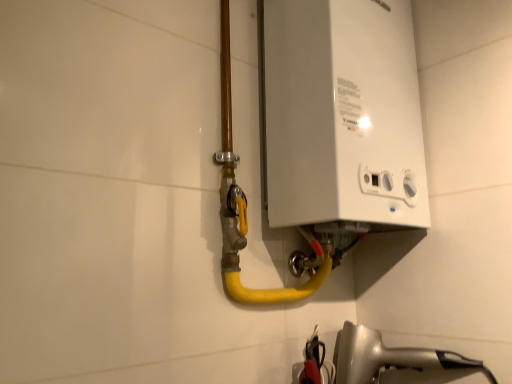
Question: Considering the positions of white plastic boiler at upper right and white glossy hairdryer at lower right in the image, is white plastic boiler at upper right taller or shorter than white glossy hairdryer at lower right?

Choices:
 (A) short
 (B) tall

Answer: (B)

Question: Is white plastic boiler at upper right wider or thinner than white glossy hairdryer at lower right?

Choices:
 (A) thin
 (B) wide

Answer: (A)

Question: From a real-world perspective, is white plastic boiler at upper right above or below white glossy hairdryer at lower right?

Choices:
 (A) below
 (B) above

Answer: (B)

Question: Considering the positions of point (452, 350) and point (376, 168), is point (452, 350) closer or farther from the camera than point (376, 168)?

Choices:
 (A) farther
 (B) closer

Answer: (A)

Question: From a real-world perspective, is white glossy hairdryer at lower right physically located above or below white plastic boiler at upper right?

Choices:
 (A) below
 (B) above

Answer: (A)

Question: Based on their sizes in the image, would you say white glossy hairdryer at lower right is bigger or smaller than white plastic boiler at upper right?

Choices:
 (A) big
 (B) small

Answer: (B)

Question: Is white glossy hairdryer at lower right taller or shorter than white plastic boiler at upper right?

Choices:
 (A) tall
 (B) short

Answer: (B)